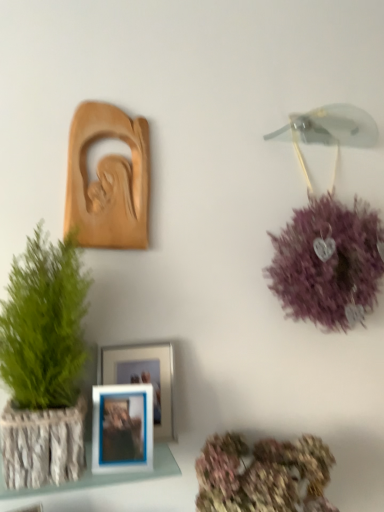
What do you see at coordinates (145, 378) in the screenshot? I see `blue plastic picture frame at center, which is counted as the second picture frame, starting from the bottom` at bounding box center [145, 378].

This screenshot has height=512, width=384. Find the location of `matte wood carving at upper left, the third picture frame when ordered from bottom to top`. matte wood carving at upper left, the third picture frame when ordered from bottom to top is located at coordinates (108, 180).

The width and height of the screenshot is (384, 512). What are the coordinates of `pastel floral bouquet at lower center` in the screenshot? It's located at (262, 475).

Measure the distance between point [354,209] and camera.

The distance of point [354,209] from camera is 1.30 meters.

Image resolution: width=384 pixels, height=512 pixels. Find the location of `purple fluffy wreath at upper right`. purple fluffy wreath at upper right is located at coordinates (328, 263).

What do you see at coordinates (44, 364) in the screenshot? I see `green textured plant at left` at bounding box center [44, 364].

Locate an element on the screen. Image resolution: width=384 pixels, height=512 pixels. white textured frame at lower left is located at coordinates (100, 475).

The width and height of the screenshot is (384, 512). What do you see at coordinates (100, 475) in the screenshot?
I see `white textured frame at lower left` at bounding box center [100, 475].

At what (x,y) coordinates should I click in order to perform the action: click on blue plastic picture frame at center, acting as the 2th picture frame starting from the top. Please return your answer as a coordinate pair (x, y). This screenshot has height=512, width=384. Looking at the image, I should click on (145, 378).

From a real-world perspective, which object rests below the other?

blue plastic picture frame at center, acting as the 2th picture frame starting from the top.

Is matte wood carving at upper left, which is the first picture frame in top-to-bottom order, far from blue plastic picture frame at center, acting as the 2th picture frame starting from the top?

They are positioned close to each other.

Where is `the 1st picture frame below when counting from the matte wood carving at upper left, which is the first picture frame in top-to-bottom order (from the image's perspective)`? the 1st picture frame below when counting from the matte wood carving at upper left, which is the first picture frame in top-to-bottom order (from the image's perspective) is located at coordinates (145, 378).

Can you tell me how much green textured plant at left and blue plastic picture frame at center, placed as the first picture frame when sorted from bottom to top, differ in facing direction?

The angular difference between green textured plant at left and blue plastic picture frame at center, placed as the first picture frame when sorted from bottom to top, is 8.71 degrees.

From the image's perspective, relative to blue plastic picture frame at center, the third picture frame in the top-to-bottom sequence, is green textured plant at left above or below?

Based on their image positions, green textured plant at left is located above blue plastic picture frame at center, the third picture frame in the top-to-bottom sequence.

Is green textured plant at left at the left side of blue plastic picture frame at center, placed as the first picture frame when sorted from bottom to top?

Correct, you'll find green textured plant at left to the left of blue plastic picture frame at center, placed as the first picture frame when sorted from bottom to top.

Is green textured plant at left facing towards blue plastic picture frame at center, the third picture frame in the top-to-bottom sequence?

No, green textured plant at left is not aimed at blue plastic picture frame at center, the third picture frame in the top-to-bottom sequence.

How different are the orientations of white textured frame at lower left and purple fluffy wreath at upper right in degrees?

The angular difference between white textured frame at lower left and purple fluffy wreath at upper right is 0.46 degrees.

The width and height of the screenshot is (384, 512). In the image, there is a purple fluffy wreath at upper right. In order to click on shelf below it (from a real-world perspective) in this screenshot , I will do `click(100, 475)`.

From a real-world perspective, which is physically above, white textured frame at lower left or purple fluffy wreath at upper right?

purple fluffy wreath at upper right.

Is white textured frame at lower left beside purple fluffy wreath at upper right?

white textured frame at lower left and purple fluffy wreath at upper right are not in contact.

Is green textured plant at left not inside pastel floral bouquet at lower center?

Yes, green textured plant at left is not within pastel floral bouquet at lower center.

Does green textured plant at left appear on the left side of pastel floral bouquet at lower center?

Correct, you'll find green textured plant at left to the left of pastel floral bouquet at lower center.

Which object is further away from the camera taking this photo, green textured plant at left or pastel floral bouquet at lower center?

pastel floral bouquet at lower center is more distant.

Is green textured plant at left in front of or behind white textured frame at lower left in the image?

Clearly, green textured plant at left is in front of white textured frame at lower left.

From the image's perspective, which one is positioned lower, green textured plant at left or white textured frame at lower left?

white textured frame at lower left is shown below in the image.

From the picture: Which object is thinner, green textured plant at left or white textured frame at lower left?

white textured frame at lower left is thinner.

Which point is more forward, (8, 335) or (161, 449)?

Positioned in front is point (8, 335).

Can you confirm if purple fluffy wreath at upper right is bigger than blue plastic picture frame at center, acting as the 2th picture frame starting from the top?

Yes, purple fluffy wreath at upper right is bigger than blue plastic picture frame at center, acting as the 2th picture frame starting from the top.

Considering the relative positions of purple fluffy wreath at upper right and blue plastic picture frame at center, acting as the 2th picture frame starting from the top, in the image provided, is purple fluffy wreath at upper right to the right of blue plastic picture frame at center, acting as the 2th picture frame starting from the top, from the viewer's perspective?

Correct, you'll find purple fluffy wreath at upper right to the right of blue plastic picture frame at center, acting as the 2th picture frame starting from the top.

Which is nearer, (283,292) or (156,347)?

Clearly, point (283,292) is more distant from the camera than point (156,347).

Is blue plastic picture frame at center, the third picture frame in the top-to-bottom sequence, turned away from blue plastic picture frame at center, which is counted as the second picture frame, starting from the bottom?

Yes, blue plastic picture frame at center, the third picture frame in the top-to-bottom sequence,'s orientation is away from blue plastic picture frame at center, which is counted as the second picture frame, starting from the bottom.

From a real-world perspective, is blue plastic picture frame at center, the third picture frame in the top-to-bottom sequence, below blue plastic picture frame at center, which is counted as the second picture frame, starting from the bottom?

Yes.

Is blue plastic picture frame at center, the third picture frame in the top-to-bottom sequence, placed right next to blue plastic picture frame at center, which is counted as the second picture frame, starting from the bottom?

No, blue plastic picture frame at center, the third picture frame in the top-to-bottom sequence, is not beside blue plastic picture frame at center, which is counted as the second picture frame, starting from the bottom.

Between blue plastic picture frame at center, the third picture frame in the top-to-bottom sequence, and blue plastic picture frame at center, which is counted as the second picture frame, starting from the bottom, which one has larger size?

With larger size is blue plastic picture frame at center, which is counted as the second picture frame, starting from the bottom.

From the matte wood carving at upper left, which is the first picture frame in top-to-bottom order, count 2nd picture frame to the right and point to it. Please provide its 2D coordinates.

[(145, 378)]

You are a GUI agent. You are given a task and a screenshot of the screen. Output one action in this format:
    pyautogui.click(x=<x>, y=<y>)
    Task: Click on the houseplant above the blue plastic picture frame at center, placed as the first picture frame when sorted from bottom to top (from the image's perspective)
    The height and width of the screenshot is (512, 384).
    Given the screenshot: What is the action you would take?
    pyautogui.click(x=44, y=364)

Considering their positions, is green textured plant at left positioned further to blue plastic picture frame at center, acting as the 2th picture frame starting from the top, than purple fluffy wreath at upper right?

Based on the image, purple fluffy wreath at upper right appears to be further to blue plastic picture frame at center, acting as the 2th picture frame starting from the top.

Which object lies nearer to the anchor point green textured plant at left, blue plastic picture frame at center, placed as the first picture frame when sorted from bottom to top, or purple fluffy wreath at upper right?

blue plastic picture frame at center, placed as the first picture frame when sorted from bottom to top, lies closer to green textured plant at left than the other object.

Which object lies nearer to the anchor point green textured plant at left, matte wood carving at upper left, which is the first picture frame in top-to-bottom order, or pastel floral bouquet at lower center?

matte wood carving at upper left, which is the first picture frame in top-to-bottom order.

Which object lies further to the anchor point white textured frame at lower left, blue plastic picture frame at center, which is counted as the second picture frame, starting from the bottom, or purple fluffy wreath at upper right?

purple fluffy wreath at upper right is further to white textured frame at lower left.

Estimate the real-world distances between objects in this image. Which object is closer to blue plastic picture frame at center, acting as the 2th picture frame starting from the top, matte wood carving at upper left, the third picture frame when ordered from bottom to top, or white textured frame at lower left?

white textured frame at lower left lies closer to blue plastic picture frame at center, acting as the 2th picture frame starting from the top, than the other object.

Consider the image. From the image, which object appears to be nearer to green textured plant at left, white textured frame at lower left or matte wood carving at upper left, the third picture frame when ordered from bottom to top?

white textured frame at lower left is positioned closer to the anchor green textured plant at left.

In the scene shown: When comparing their distances from white textured frame at lower left, does blue plastic picture frame at center, the third picture frame in the top-to-bottom sequence, or green textured plant at left seem closer?

blue plastic picture frame at center, the third picture frame in the top-to-bottom sequence.

When comparing their distances from white textured frame at lower left, does green textured plant at left or pastel floral bouquet at lower center seem further?

The object further to white textured frame at lower left is pastel floral bouquet at lower center.

Identify the location of picture frame between blue plastic picture frame at center, the third picture frame in the top-to-bottom sequence, and pastel floral bouquet at lower center, in the horizontal direction. (145, 378).

Where is `houseplant between matte wood carving at upper left, which is the first picture frame in top-to-bottom order, and blue plastic picture frame at center, which is counted as the second picture frame, starting from the bottom, from top to bottom`? This screenshot has width=384, height=512. houseplant between matte wood carving at upper left, which is the first picture frame in top-to-bottom order, and blue plastic picture frame at center, which is counted as the second picture frame, starting from the bottom, from top to bottom is located at coordinates (44, 364).

You are a GUI agent. You are given a task and a screenshot of the screen. Output one action in this format:
    pyautogui.click(x=<x>, y=<y>)
    Task: Click on the floral arrangement situated between green textured plant at left and purple fluffy wreath at upper right from left to right
    This screenshot has width=384, height=512.
    Given the screenshot: What is the action you would take?
    pyautogui.click(x=262, y=475)

Find the location of `shelf that lies between purple fluffy wreath at upper right and pastel floral bouquet at lower center from top to bottom`. shelf that lies between purple fluffy wreath at upper right and pastel floral bouquet at lower center from top to bottom is located at coordinates (100, 475).